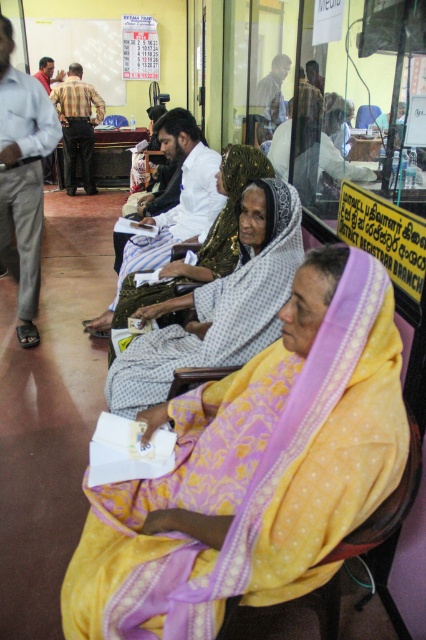
Looking at this image, you are standing in the waiting area of the District Registrar Branch and want to take a photo of both the point at coordinates (x=187, y=140) and the point at (x=267, y=116). Which point will appear larger in your photo?

Point at coordinates (x=187, y=140) will appear larger in the photo because it is closer to the camera than point at coordinates (x=267, y=116).

You are a visitor in the District Registrar Branch and you want to sit down. There is a white striped shirt at center and a light brown wooden chair at upper center in your view. Which object is closer to you that you can reach first?

The white striped shirt at center is closer to the viewer than the light brown wooden chair at upper center, so you can reach it first.

You are a visitor in the District Registrar Branch and need to sit down. You see a yellow fabric headscarf at center and a light brown wooden chair at upper center. Which object is closer to you?

The yellow fabric headscarf at center is positioned under the light brown wooden chair at upper center, meaning it is closer to you since it is below the chair in the scene.